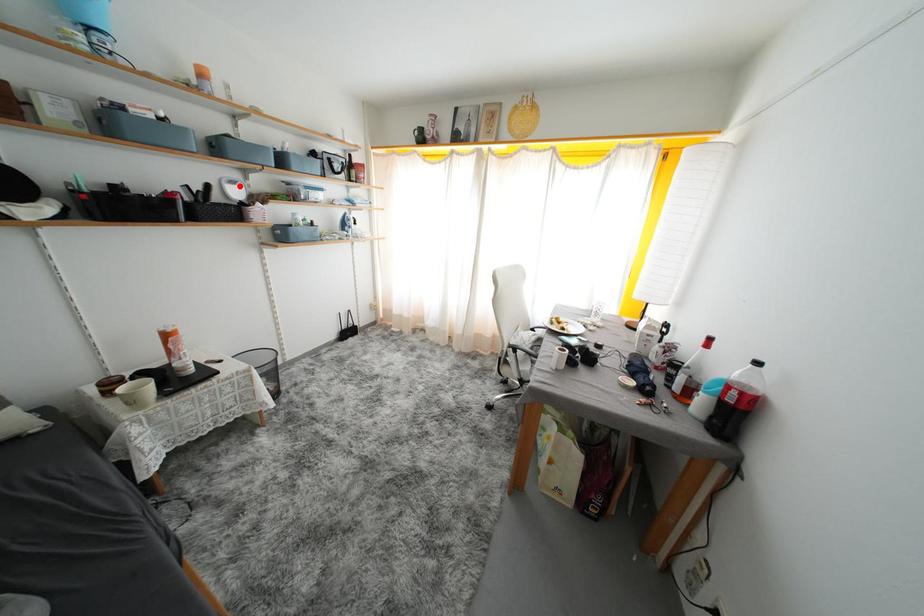
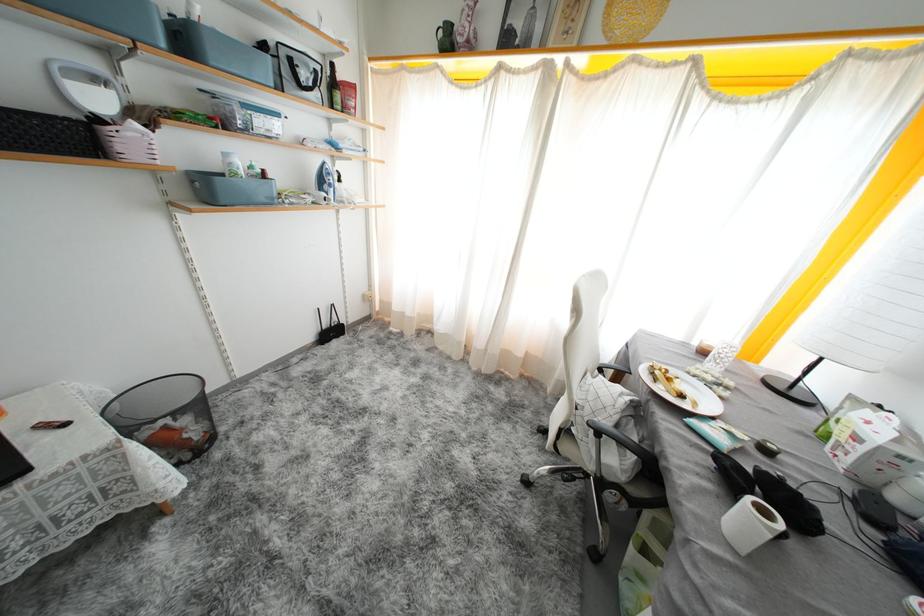
Question: I am providing you with two images of the same scene from different viewpoints. Given a red point in image1, look at the same physical point in image2. Is it:

Choices:
 (A) Closer to the viewpoint
 (B) Farther from the viewpoint

Answer: (B)